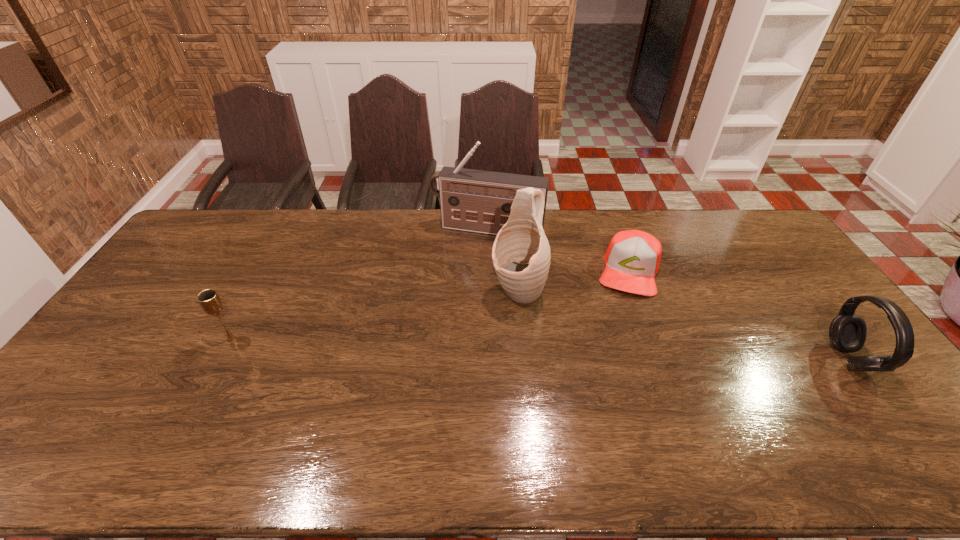
This screenshot has height=540, width=960. In order to click on the leftmost object in this screenshot , I will do `click(209, 300)`.

At what (x,y) coordinates should I click in order to perform the action: click on headset. Please return your answer as a coordinate pair (x, y). The height and width of the screenshot is (540, 960). Looking at the image, I should click on pyautogui.click(x=847, y=332).

Where is `baseball cap`? The image size is (960, 540). baseball cap is located at coordinates (632, 260).

The height and width of the screenshot is (540, 960). I want to click on the shortest object, so click(x=632, y=260).

This screenshot has width=960, height=540. Find the location of `pitcher`. pitcher is located at coordinates (521, 255).

Locate an element on the screen. The height and width of the screenshot is (540, 960). the farthest object is located at coordinates (479, 201).

Where is `free space located 0.380m on the right of the chalice`? free space located 0.380m on the right of the chalice is located at coordinates (373, 339).

In order to click on free spot located on the front-facing side of the baseball cap in this screenshot , I will do `click(622, 332)`.

Where is `vacant space located 0.270m on the front-facing side of the baseball cap`? vacant space located 0.270m on the front-facing side of the baseball cap is located at coordinates (617, 364).

Identify the location of vacant area situated 0.150m on the front-facing side of the baseball cap. The height and width of the screenshot is (540, 960). (622, 332).